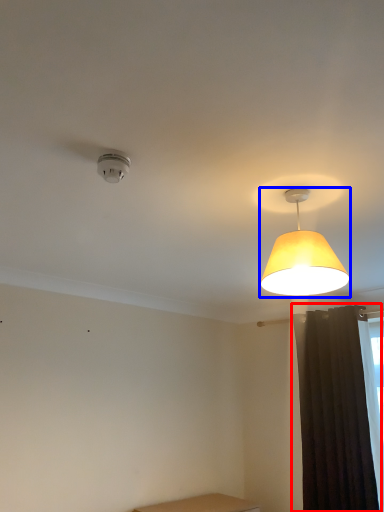
Question: Which object is further to the camera taking this photo, curtain (highlighted by a red box) or lamp (highlighted by a blue box)?

Choices:
 (A) curtain
 (B) lamp

Answer: (A)